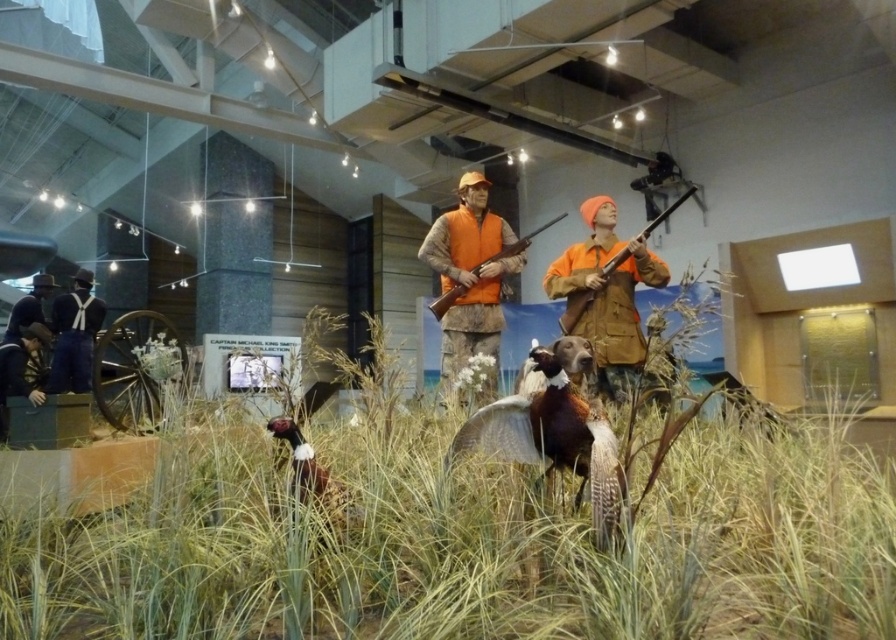
Which is more to the left, green grass at center or brown feathered bird at center?

From the viewer's perspective, green grass at center appears more on the left side.

Based on the photo, between green grass at center and brown feathered bird at center, which one has more height?

Standing taller between the two is brown feathered bird at center.

Measure the distance between point (x=289, y=632) and camera.

Point (x=289, y=632) is 1.64 meters from camera.

Image resolution: width=896 pixels, height=640 pixels. I want to click on green grass at center, so click(x=468, y=547).

Can you confirm if orange fabric jacket at center is smaller than brown speckled feathers at center?

No, orange fabric jacket at center is not smaller than brown speckled feathers at center.

From the picture: Is orange fabric jacket at center below brown speckled feathers at center?

No.

Who is more forward, (570,300) or (341,506)?

Point (341,506)

Find the location of `orange fabric jacket at center`. orange fabric jacket at center is located at coordinates (606, 294).

Which of these two, green grass at center or brown speckled feathers at center, stands shorter?

Standing shorter between the two is brown speckled feathers at center.

Does green grass at center have a lesser width compared to brown speckled feathers at center?

Incorrect, green grass at center's width is not less than brown speckled feathers at center's.

Does point (188, 612) come farther from viewer compared to point (302, 451)?

That is False.

Identify the location of green grass at center. This screenshot has height=640, width=896. (468, 547).